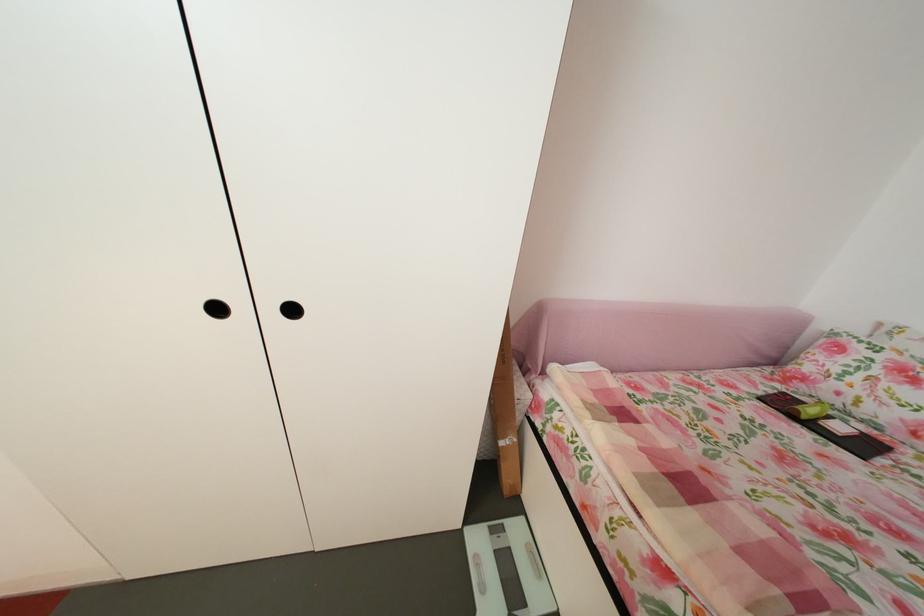
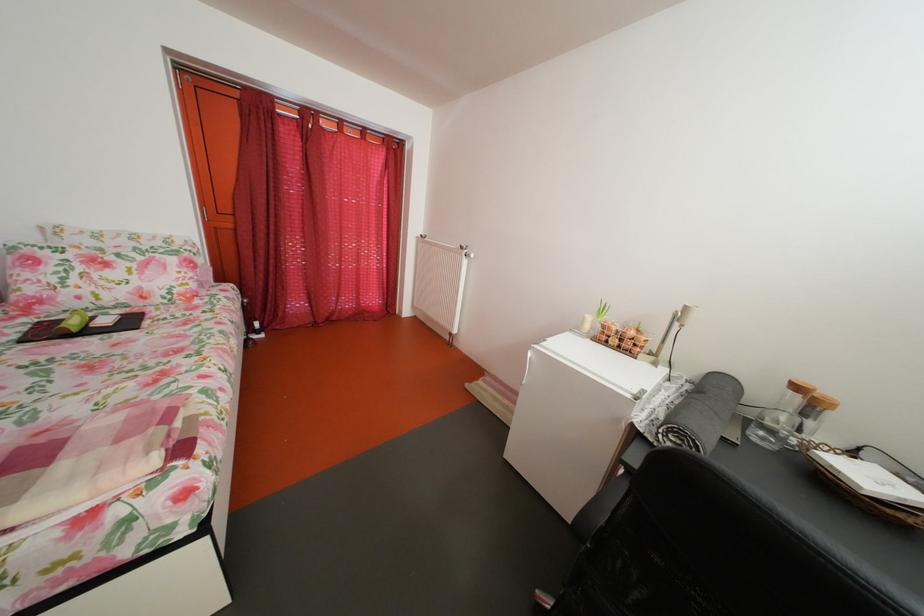
In the second image, find the point that corresponds to the point at 820,418 in the first image.

(83, 330)